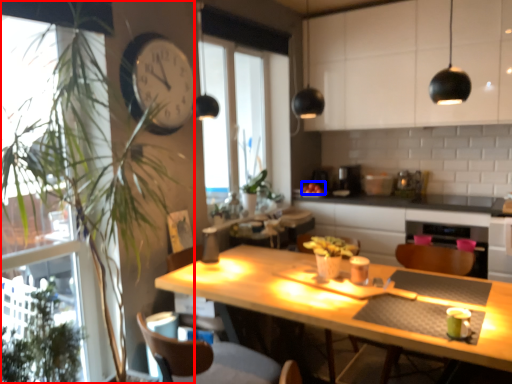
Question: Which point is further to the camera, houseplant (highlighted by a red box) or fruit (highlighted by a blue box)?

Choices:
 (A) houseplant
 (B) fruit

Answer: (B)